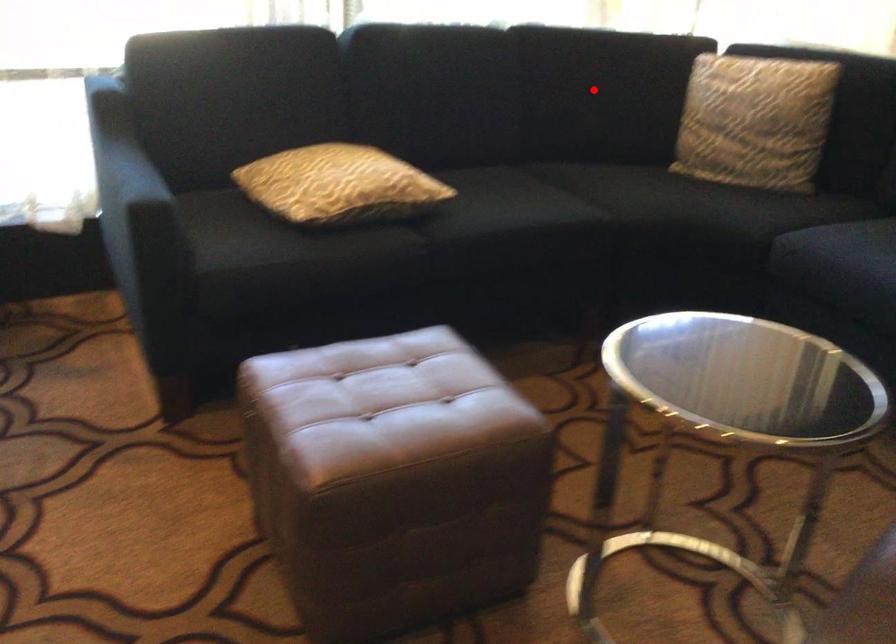
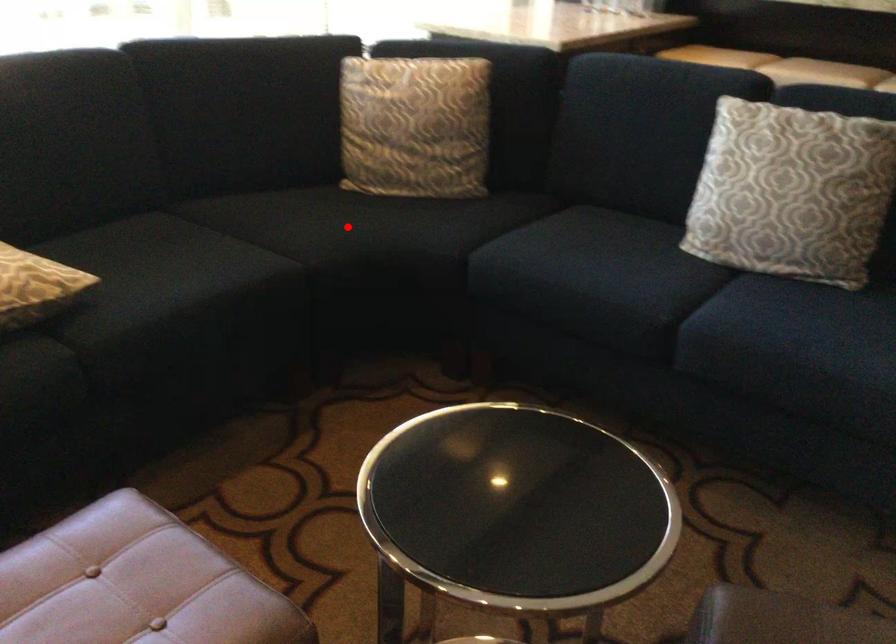
I am providing you with two images of the same scene from different viewpoints. A red point is marked on the first image and another point is marked on the second image. Is the red point in image1 aligned with the point shown in image2?

No